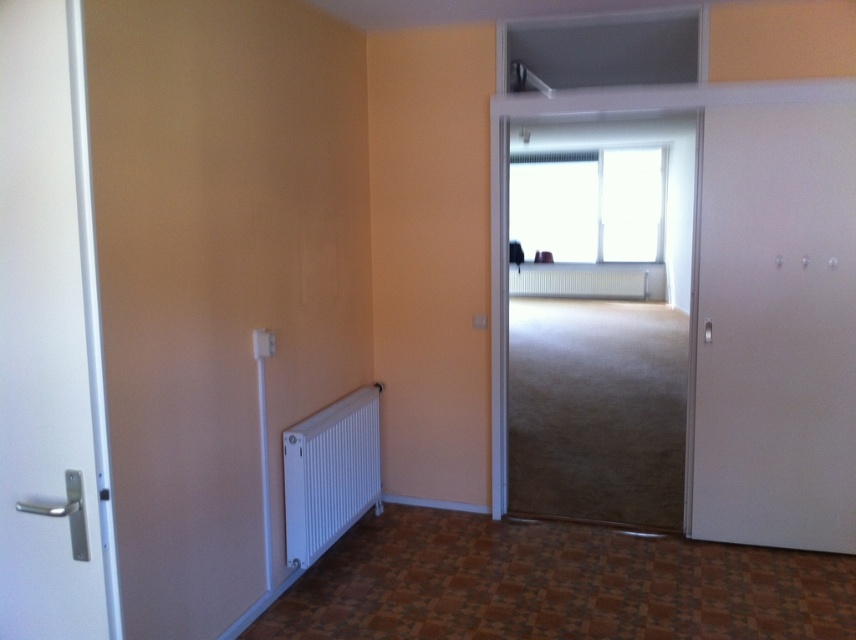
Question: Which of the following is the farthest from the observer?

Choices:
 (A) white matte door at left
 (B) white matte radiator at center

Answer: (B)

Question: Is white matte door at right to the left of white metallic radiator at lower left from the viewer's perspective?

Choices:
 (A) no
 (B) yes

Answer: (A)

Question: Is white metallic radiator at lower left below white matte radiator at center?

Choices:
 (A) no
 (B) yes

Answer: (B)

Question: Which point is farther to the camera?

Choices:
 (A) (82, 586)
 (B) (651, 284)

Answer: (B)

Question: Can you confirm if white matte door at left is positioned to the right of white matte radiator at center?

Choices:
 (A) yes
 (B) no

Answer: (B)

Question: Considering the real-world distances, which object is farthest from the white matte door at right?

Choices:
 (A) white metallic radiator at lower left
 (B) white matte radiator at center

Answer: (B)